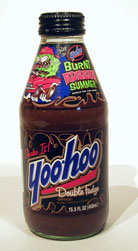
Locate an element on the screen. This screenshot has height=251, width=138. black bottle lid is located at coordinates (65, 24).